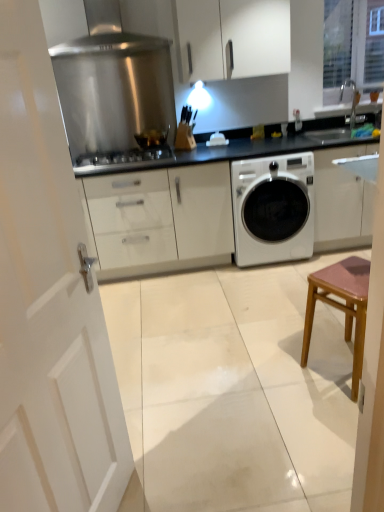
At what (x,y) coordinates should I click in order to perform the action: click on vacant space positioned to the left of pink wood stool at right. Please return your answer as a coordinate pair (x, y). Image resolution: width=384 pixels, height=512 pixels. Looking at the image, I should click on (286, 384).